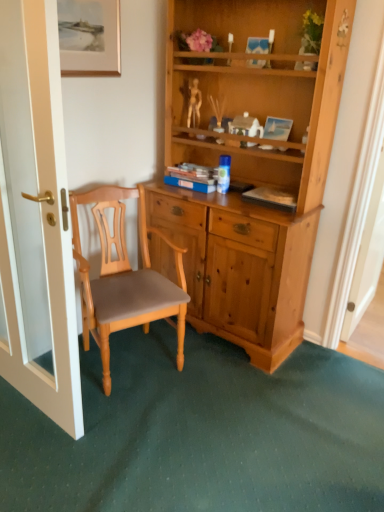
Where is `space that is in front of white glossy door at left`? space that is in front of white glossy door at left is located at coordinates (37, 449).